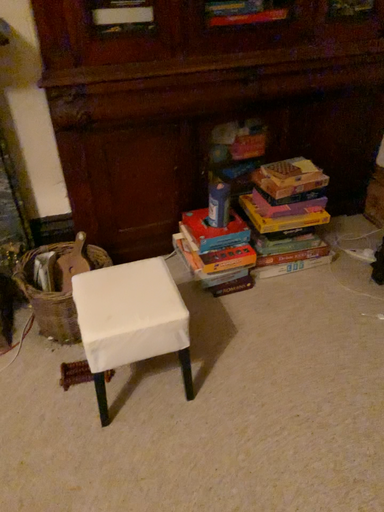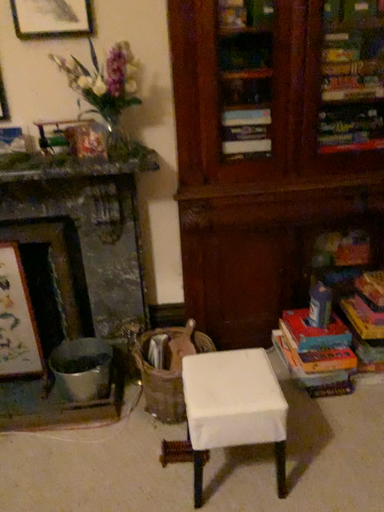
Question: How did the camera likely rotate when shooting the video?

Choices:
 (A) rotated upward
 (B) rotated downward

Answer: (A)